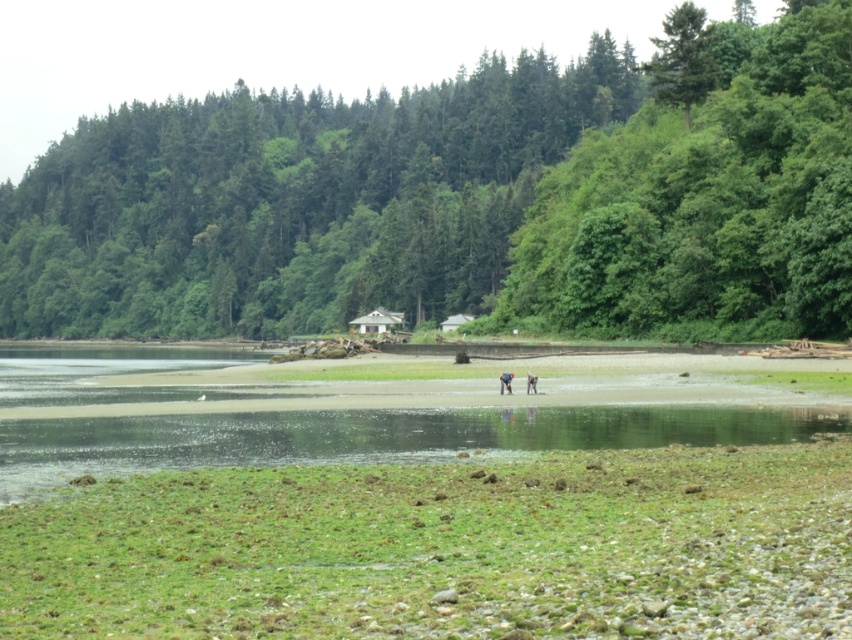
Who is shorter, green leafy tree at center or dark gray fabric person at center?

dark gray fabric person at center

Does green leafy tree at center have a greater height compared to dark gray fabric person at center?

Indeed, green leafy tree at center has a greater height compared to dark gray fabric person at center.

Which is behind, point (344, 116) or point (502, 387)?

Positioned behind is point (344, 116).

Where is `green leafy tree at center`? The height and width of the screenshot is (640, 852). green leafy tree at center is located at coordinates (453, 202).

The height and width of the screenshot is (640, 852). Identify the location of green leafy tree at center. click(x=453, y=202).

Does point (508, 384) come closer to viewer compared to point (527, 374)?

Yes, it is in front of point (527, 374).

Is point (502, 381) behind point (530, 372)?

No, it is not.

The height and width of the screenshot is (640, 852). I want to click on dark gray fabric person at center, so click(505, 381).